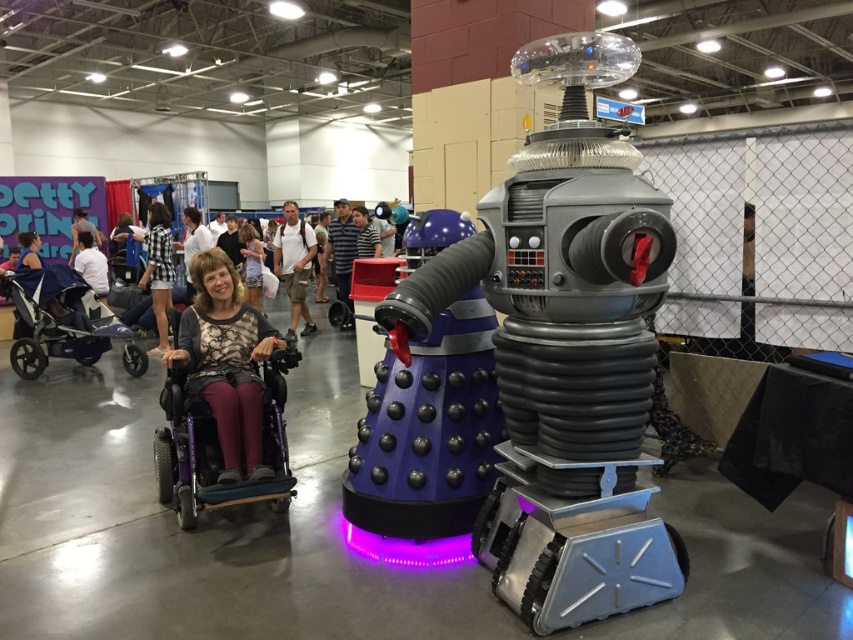
You are a photographer at the event and need to capture both the light brown fabric shirt at center and the matte white shirt at upper left in a single photo. Which shirt should you focus on to ensure both are in frame without zooming?

You should focus on the light brown fabric shirt at center since it is larger and positioned centrally, making it easier to frame both shirts without zooming.

You are a person in a wheelchair who wants to reach the Dalek and the Cyberman in the scene. Given that your wheelchair has a turning radius of 1.2 meters, can you navigate to the Dalek and the Cyberman from your current position near the purple matte wheelchair at lower left?

The purple matte wheelchair at lower left is 2.81 meters away from camera. Since the wheelchair has a turning radius of 1.2 meters, you can navigate to the Dalek and the Cyberman as long as the path allows for turns within that radius. However, the exact feasibility depends on the layout of the venue and any obstacles between you and the robots, which are not specified here.

You are standing at the entrance of the convention hall and see two points marked in the scene. Which point is closer to you, point 1 at coordinates (273, 256) or point 2 at coordinates (88, 269)?

Point 1 at coordinates (273, 256) is closer to you because it is further to the viewer than point 2 at coordinates (88, 269).